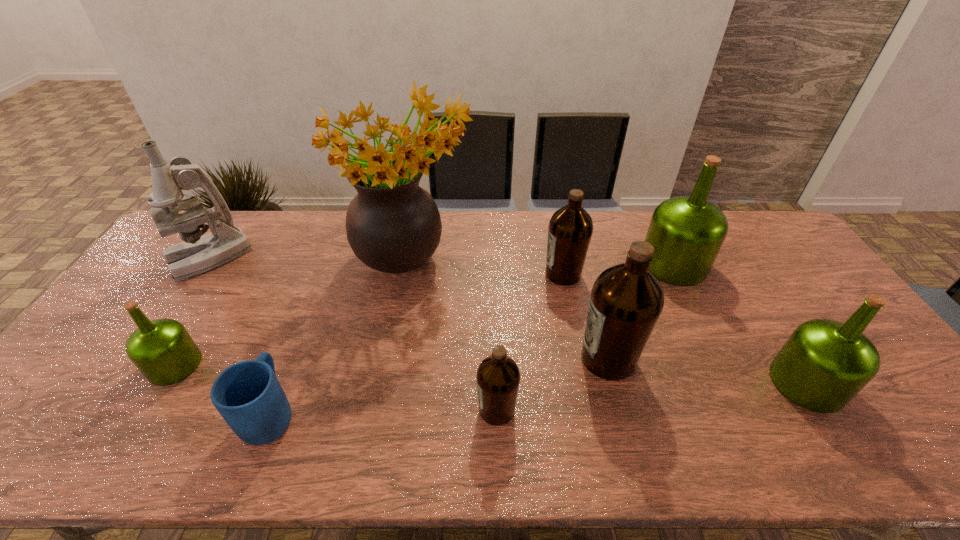
Where is `free space at the left edge`? free space at the left edge is located at coordinates (166, 282).

Image resolution: width=960 pixels, height=540 pixels. In order to click on blank space at the right edge of the desktop in this screenshot , I will do `click(874, 410)`.

Where is `free spot between the gray microscope and the leftmost green olive oil`? The image size is (960, 540). free spot between the gray microscope and the leftmost green olive oil is located at coordinates (192, 312).

At what (x,y) coordinates should I click in order to perform the action: click on free space between the farthest green olive oil and the smallest green olive oil. Please return your answer as a coordinate pair (x, y). Looking at the image, I should click on (424, 314).

Find the location of a particular element. Image resolution: width=960 pixels, height=540 pixels. vacant space that's between the fifth olive oil from right to left and the gray microscope is located at coordinates (352, 334).

What are the coordinates of `unoccupied position between the leftmost olive oil and the tallest object` in the screenshot? It's located at [x=294, y=312].

Where is `blank region between the leftmost olive oil and the biggest brown olive oil`? This screenshot has height=540, width=960. blank region between the leftmost olive oil and the biggest brown olive oil is located at coordinates (392, 362).

At what (x,y) coordinates should I click in order to perform the action: click on empty space between the fourth object from left to right and the biggest green olive oil. Please return your answer as a coordinate pair (x, y). The width and height of the screenshot is (960, 540). Looking at the image, I should click on (542, 262).

Identify the location of free spot between the blue mug and the second olive oil from left to right. (384, 411).

Locate an element on the screen. This screenshot has width=960, height=540. blank region between the mug and the flower arrangement is located at coordinates (342, 336).